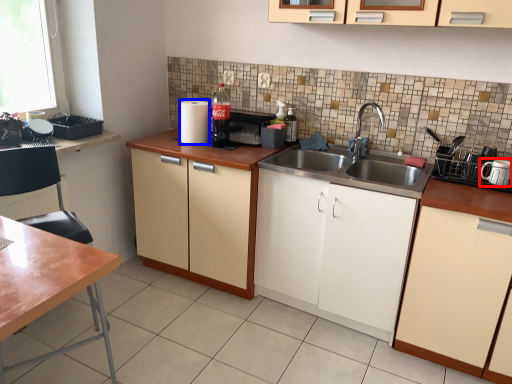
Question: Among these objects, which one is farthest to the camera, appliance (highlighted by a red box) or appliance (highlighted by a blue box)?

Choices:
 (A) appliance
 (B) appliance

Answer: (B)